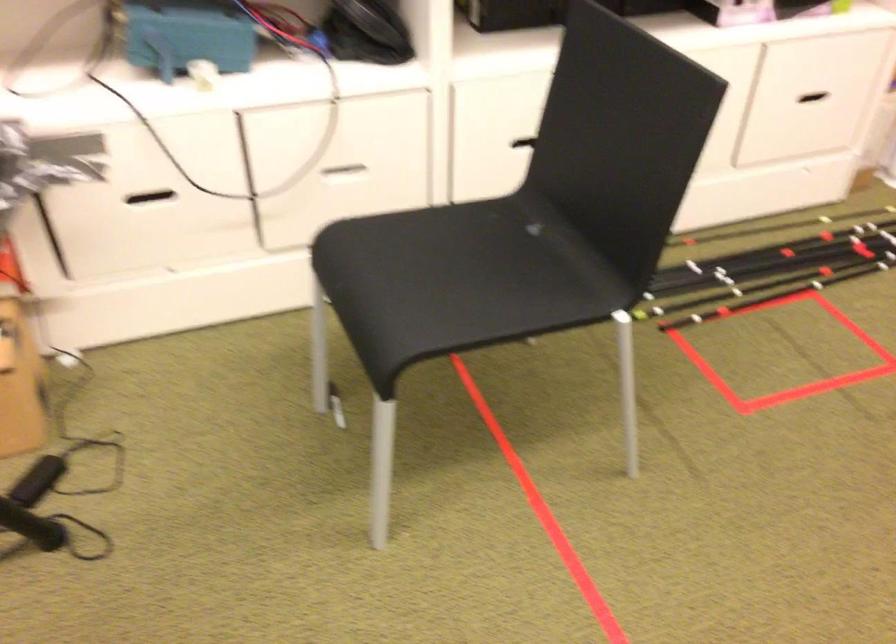
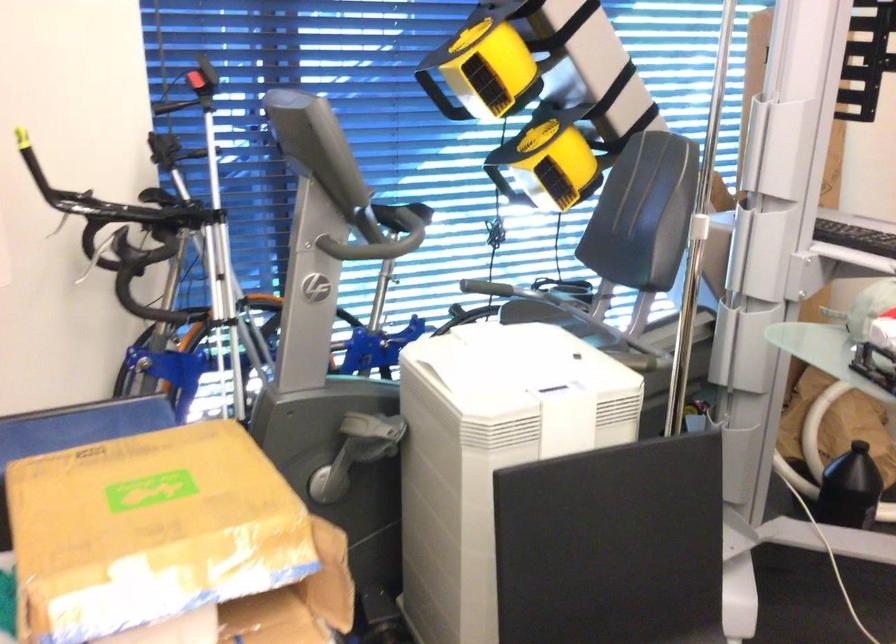
Question: The camera is either moving clockwise (left) or counter-clockwise (right) around the object. The first image is from the beginning of the video and the second image is from the end. Is the camera moving left or right when shooting the video?

Choices:
 (A) Left
 (B) Right

Answer: (B)